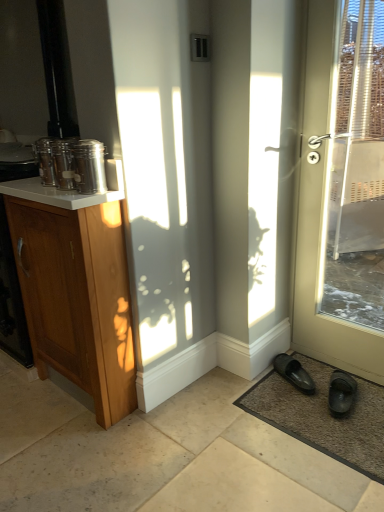
Where is `vacant space to the left of black rubber slippers at lower right, which appears as the 1th footwear when viewed from the right`? vacant space to the left of black rubber slippers at lower right, which appears as the 1th footwear when viewed from the right is located at coordinates (296, 406).